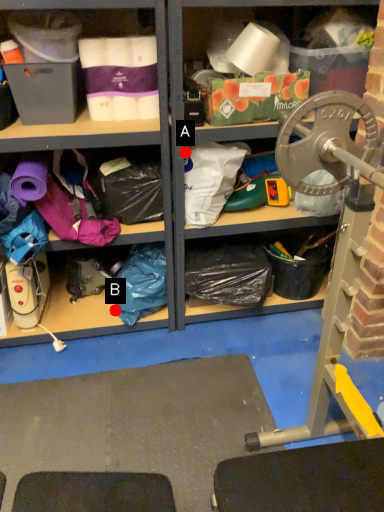
Question: Two points are circled on the image, labeled by A and B beside each circle. Which of the following is the closest to the observer?

Choices:
 (A) A is closer
 (B) B is closer

Answer: (A)